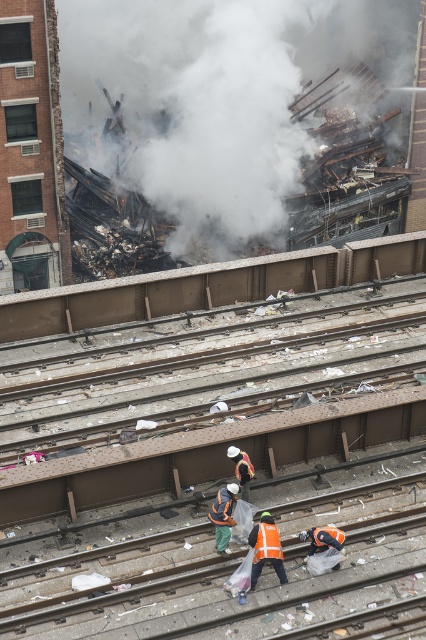
Question: Which point is closer to the camera taking this photo?

Choices:
 (A) (256, 93)
 (B) (259, 538)
 (C) (270, 554)

Answer: (C)

Question: Which point is closer to the camera taking this photo?

Choices:
 (A) (255, 557)
 (B) (268, 548)

Answer: (B)

Question: Does reflective orange vest at center have a larger size compared to orange reflective safety vest at lower center?

Choices:
 (A) yes
 (B) no

Answer: (A)

Question: Can you confirm if reflective orange vest at center is positioned below orange reflective safety vest at lower center?

Choices:
 (A) no
 (B) yes

Answer: (B)

Question: Which object is farther from the camera taking this photo?

Choices:
 (A) reflective orange vest at center
 (B) orange reflective safety vest at lower center
 (C) white smoke at upper center

Answer: (C)

Question: Where is white smoke at upper center located in relation to orange reflective safety vest at lower center in the image?

Choices:
 (A) above
 (B) below

Answer: (A)